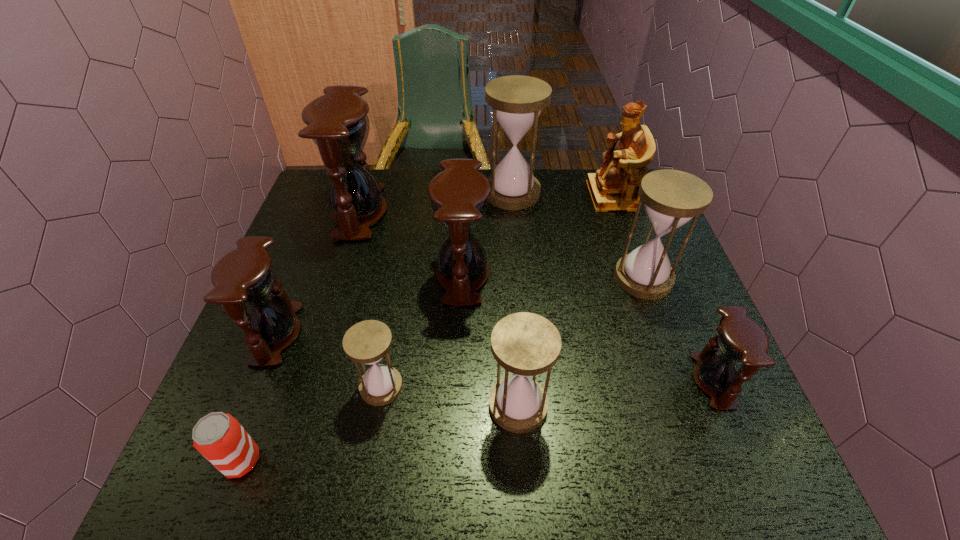
Identify the location of empty location between the biggest brown hourglass and the third smallest brown hourglass. (411, 244).

You are a GUI agent. You are given a task and a screenshot of the screen. Output one action in this format:
    pyautogui.click(x=<x>, y=<y>)
    Task: Click on the free space between the farthest white hourglass and the third smallest brown hourglass
    The height and width of the screenshot is (540, 960).
    Given the screenshot: What is the action you would take?
    pyautogui.click(x=488, y=234)

Image resolution: width=960 pixels, height=540 pixels. I want to click on free space between the farthest white hourglass and the figurine, so point(562,194).

The image size is (960, 540). Find the location of `free space between the third biggest brown hourglass and the third biggest white hourglass`. free space between the third biggest brown hourglass and the third biggest white hourglass is located at coordinates [x=397, y=370].

What are the coordinates of `object that is the third closest to the rightmost brown hourglass` in the screenshot? It's located at (459, 195).

Locate which object is the closest to the farthest white hourglass. Please provide its 2D coordinates. Your answer should be formatted as a tuple, i.e. [(x, y)], where the tuple contains the x and y coordinates of a point satisfying the conditions above.

[(613, 188)]

You are a GUI agent. You are given a task and a screenshot of the screen. Output one action in this format:
    pyautogui.click(x=<x>, y=<y>)
    Task: Click on the second closest hourglass to the figurine
    The width and height of the screenshot is (960, 540).
    Given the screenshot: What is the action you would take?
    pyautogui.click(x=672, y=198)

At what (x,y) coordinates should I click in order to perform the action: click on hourglass identified as the fifth closest to the second smallest white hourglass. Please return your answer as a coordinate pair (x, y). Looking at the image, I should click on (245, 276).

Locate an element on the screen. Image resolution: width=960 pixels, height=540 pixels. brown hourglass that stands as the closest to the third smallest white hourglass is located at coordinates (740, 339).

You are a GUI agent. You are given a task and a screenshot of the screen. Output one action in this format:
    pyautogui.click(x=<x>, y=<y>)
    Task: Click on the brown hourglass identified as the third closest to the biggest white hourglass
    
    Given the screenshot: What is the action you would take?
    pyautogui.click(x=245, y=276)